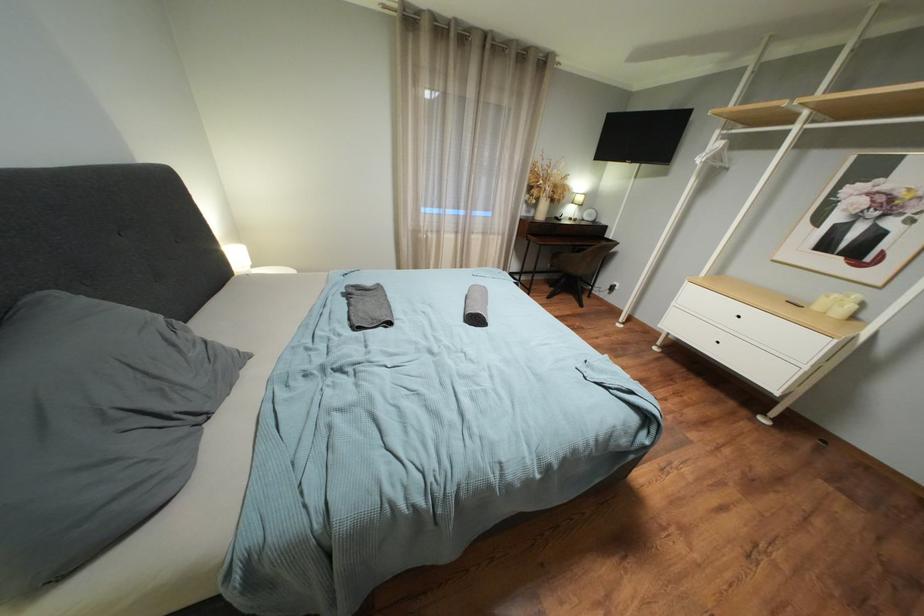
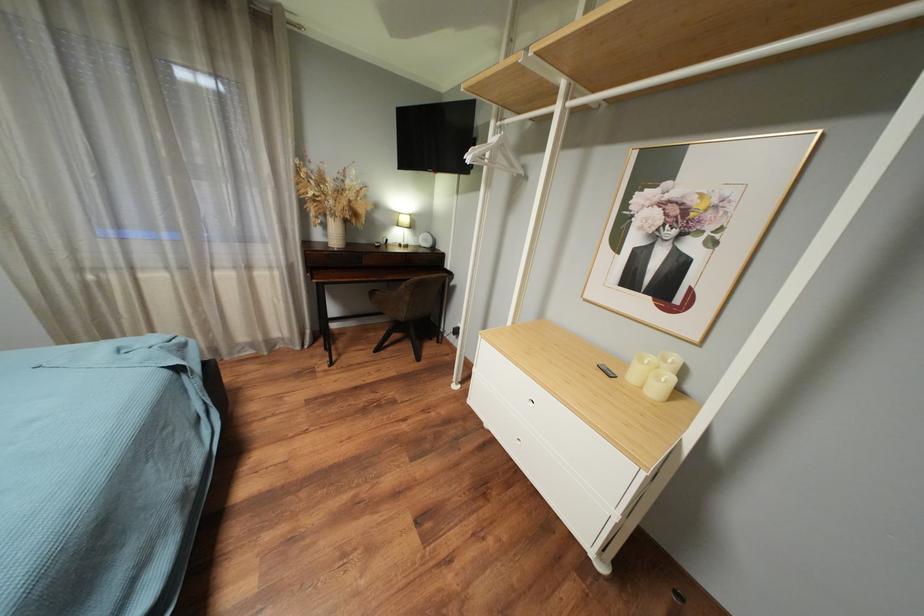
What movement of the cameraman would produce the second image?

The cameraman moved toward right, forward.